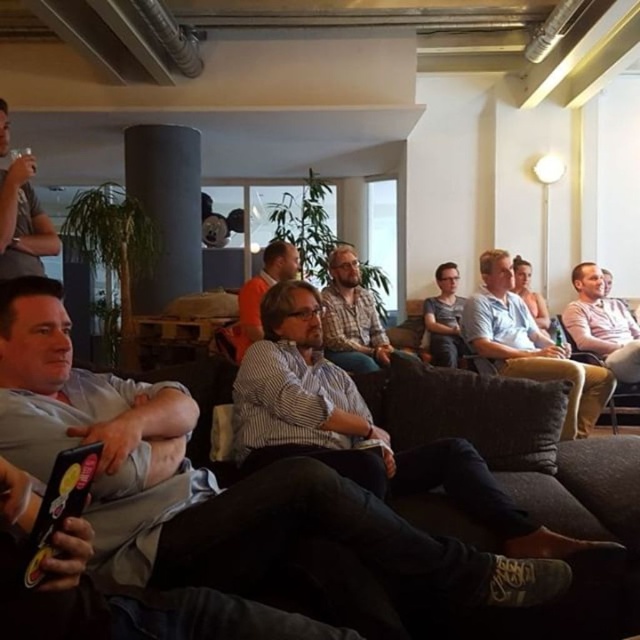
You are standing in the room and want to reach both the point at coordinates (362, 324) and the point at coordinates (20, 216). Which point will you physically touch first as you move forward?

You will physically touch the point at coordinates (20, 216) first because it is closer to you than the point at coordinates (362, 324), which is further away.

You are organizing a photo shoot and need to arrange two shirts on a mannequin. The plaid shirt at center and the pink cotton shirt at right must be placed side by side. Which shirt should you place on the left side to ensure they fit within a 1.2 meter wide display area?

The plaid shirt at center has a lesser width compared to the pink cotton shirt at right. To fit both shirts within the 1.2 meter display area, place the narrower plaid shirt at center on the left side so that the wider pink cotton shirt at right can be positioned next to it without exceeding the width limit.